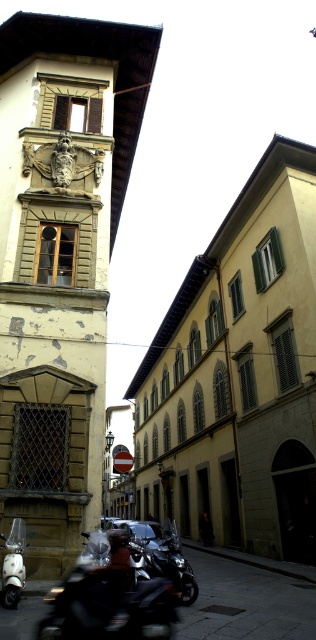
You are a tourist standing in the middle of the narrow street. You want to take a photo of the yellowish stone tower at center and the shiny black motorcycle at lower left. Which object should you position to your left side to capture both in the frame?

You should position the shiny black motorcycle at lower left to your left side because the yellowish stone tower at center is to the left of the shiny black motorcycle at lower left. This way, both objects will be included in your photo frame.

You are a delivery person needing to park your shiny black motorcycle at lower left in this narrow street. Considering the street layout and the motorcycle position, can you estimate its exact coordinates in the image?

The shiny black motorcycle at lower left is located at coordinates 0.936 on the x axis and 0.345 on the y axis.